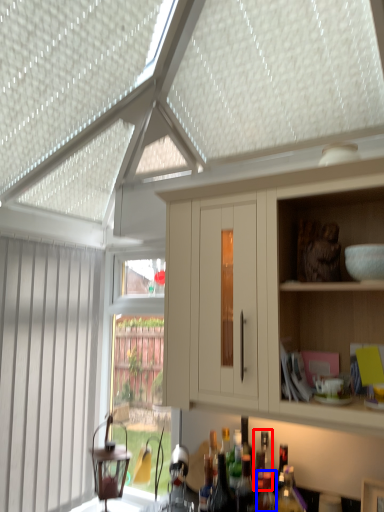
Question: Which object appears closest to the camera in this image, bottle (highlighted by a red box) or bottle (highlighted by a blue box)?

Choices:
 (A) bottle
 (B) bottle

Answer: (B)